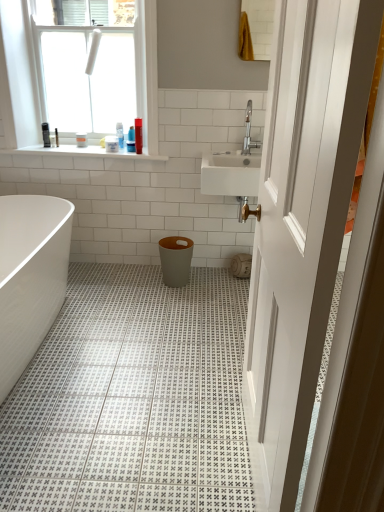
Question: Is white plastic container at upper center wider or thinner than white glossy window at upper left?

Choices:
 (A) thin
 (B) wide

Answer: (B)

Question: Considering the relative positions of white plastic container at upper center and white glossy window at upper left in the image provided, is white plastic container at upper center to the left or to the right of white glossy window at upper left?

Choices:
 (A) left
 (B) right

Answer: (B)

Question: Which is nearer to the white plastic container at upper center?

Choices:
 (A) gold textured towel at upper right
 (B) white glossy window at upper left
 (C) matte gray trash can at center
 (D) silver metallic faucet at upper right
 (E) white glossy bathtub at lower left

Answer: (B)

Question: Based on their relative distances, which object is nearer to the white glossy window at upper left?

Choices:
 (A) white glossy bathtub at lower left
 (B) matte gray trash can at center
 (C) white glossy counter top at upper left
 (D) gold textured towel at upper right
 (E) white plastic container at upper center

Answer: (C)